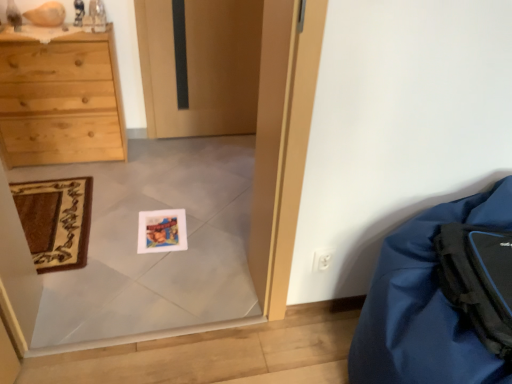
Question: Considering the relative positions of blue fabric bean bag at lower right and carpeted mat at lower left in the image provided, is blue fabric bean bag at lower right to the left or to the right of carpeted mat at lower left?

Choices:
 (A) left
 (B) right

Answer: (B)

Question: From a real-world perspective, is blue fabric bean bag at lower right physically located above or below carpeted mat at lower left?

Choices:
 (A) below
 (B) above

Answer: (B)

Question: Which object is the closest to the blue fabric bean bag at lower right?

Choices:
 (A) black matte backpack at lower right
 (B) carpeted mat at lower left

Answer: (A)

Question: Based on their relative distances, which object is nearer to the black matte backpack at lower right?

Choices:
 (A) blue fabric bean bag at lower right
 (B) carpeted mat at lower left

Answer: (A)